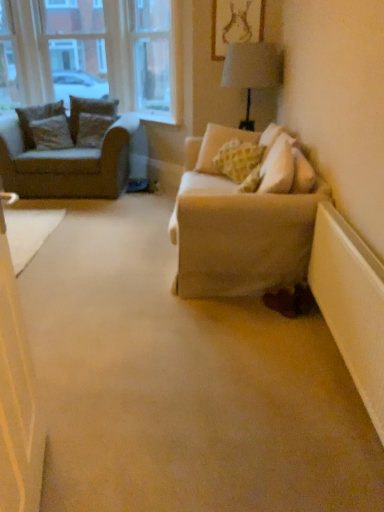
Question: Could you tell me if brown textured pillow at left, the first pillow when ordered from left to right, is turned towards white plastic radiator at lower right?

Choices:
 (A) no
 (B) yes

Answer: (B)

Question: From the image's perspective, does brown textured pillow at left, acting as the 4th pillow starting from the right, appear lower than white plastic radiator at lower right?

Choices:
 (A) no
 (B) yes

Answer: (A)

Question: Does brown textured pillow at left, the first pillow when ordered from left to right, have a larger size compared to white plastic radiator at lower right?

Choices:
 (A) yes
 (B) no

Answer: (A)

Question: Would you consider brown textured pillow at left, the first pillow when ordered from left to right, to be distant from white plastic radiator at lower right?

Choices:
 (A) no
 (B) yes

Answer: (B)

Question: Can you confirm if brown textured pillow at left, acting as the 4th pillow starting from the right, is thinner than white plastic radiator at lower right?

Choices:
 (A) yes
 (B) no

Answer: (B)

Question: Is brown textured pillow at left, acting as the 4th pillow starting from the right, positioned beyond the bounds of white plastic radiator at lower right?

Choices:
 (A) yes
 (B) no

Answer: (A)

Question: Is matte gold picture frame at upper center at the right side of brown textured pillow at left, acting as the 4th pillow starting from the right?

Choices:
 (A) yes
 (B) no

Answer: (A)

Question: Is matte gold picture frame at upper center looking in the opposite direction of brown textured pillow at left, acting as the 4th pillow starting from the right?

Choices:
 (A) yes
 (B) no

Answer: (B)

Question: From the image's perspective, is matte gold picture frame at upper center on top of brown textured pillow at left, the first pillow when ordered from left to right?

Choices:
 (A) no
 (B) yes

Answer: (B)

Question: Considering the relative positions of matte gold picture frame at upper center and brown textured pillow at left, acting as the 4th pillow starting from the right, in the image provided, is matte gold picture frame at upper center to the left of brown textured pillow at left, acting as the 4th pillow starting from the right, from the viewer's perspective?

Choices:
 (A) no
 (B) yes

Answer: (A)

Question: From the image's perspective, would you say matte gold picture frame at upper center is shown under brown textured pillow at left, acting as the 4th pillow starting from the right?

Choices:
 (A) no
 (B) yes

Answer: (A)

Question: Does matte gold picture frame at upper center have a greater width compared to brown textured pillow at left, acting as the 4th pillow starting from the right?

Choices:
 (A) no
 (B) yes

Answer: (A)

Question: From a real-world perspective, is velvet brown pillow at left, which ranks as the second pillow in right-to-left order, on top of brown textured pillow at left, arranged as the second pillow when viewed from the left?

Choices:
 (A) yes
 (B) no

Answer: (A)